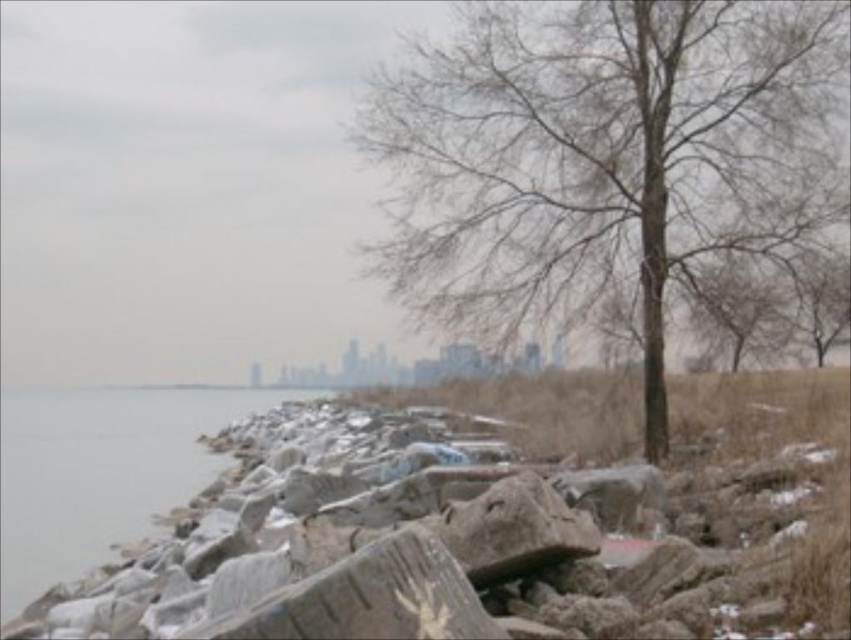
Question: Can you confirm if bare wood tree at center is positioned to the right of gray stone water at left?

Choices:
 (A) yes
 (B) no

Answer: (A)

Question: Which point is closer to the camera?

Choices:
 (A) bare wood tree at center
 (B) gray stone water at left

Answer: (B)

Question: Is bare wood tree at center smaller than gray stone water at left?

Choices:
 (A) yes
 (B) no

Answer: (A)

Question: Among these points, which one is nearest to the camera?

Choices:
 (A) (337, 504)
 (B) (624, 164)

Answer: (A)

Question: Estimate the real-world distances between objects in this image. Which object is farther from the gray stone rocks at lower left?

Choices:
 (A) bare wood tree at center
 (B) gray stone water at left

Answer: (B)

Question: Can you confirm if gray stone rocks at lower left is positioned below bare wood tree at center?

Choices:
 (A) yes
 (B) no

Answer: (A)